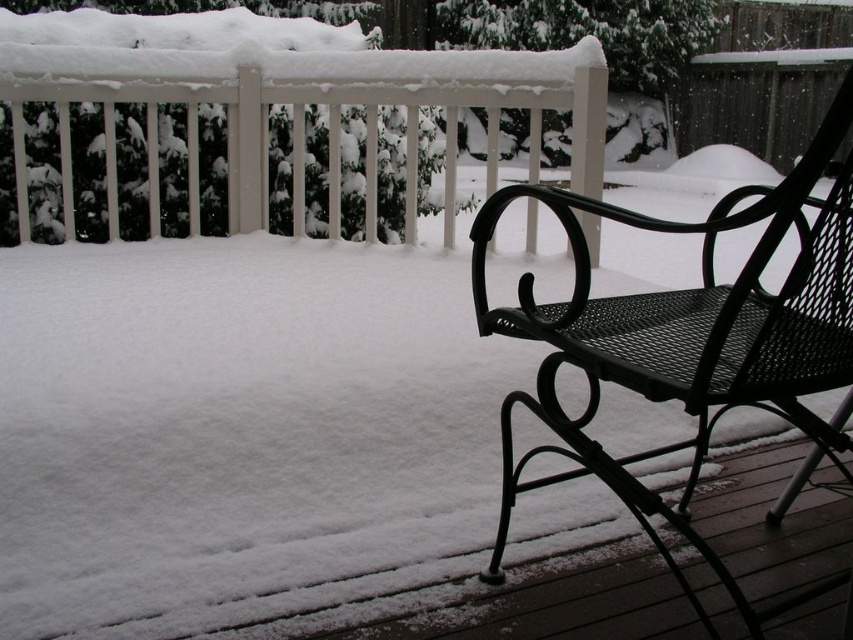
You are standing on the deck and want to place a small potted plant on the black mesh chair at right. However, you notice the white painted wood railing at upper left. Is the railing above or below the chair?

The black mesh chair at right is positioned under the white painted wood railing at upper left, so the railing is above the chair.

You are standing on the wooden deck and want to move from the white painted wood railing at upper left to the black mesh chair at right. Which direction should you move to reach the chair?

The black mesh chair at right is to the right of the white painted wood railing at upper left, so you should move to the right to reach it.

You are standing at the center of the wooden deck. You want to sit down on the black mesh chair at right. In which direction should you walk?

You should walk to the right because the black mesh chair at right is located at the right side of the deck.